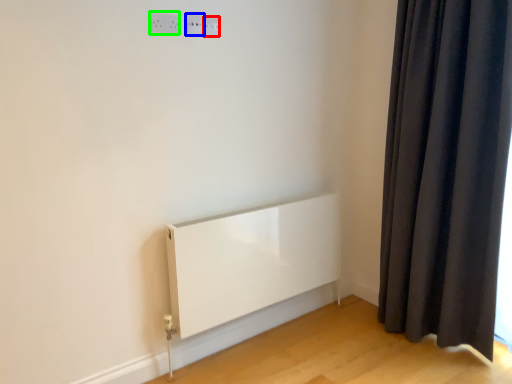
Question: Based on their relative distances, which object is nearer to electric outlet (highlighted by a red box)? Choose from electric outlet (highlighted by a blue box) and electric outlet (highlighted by a green box).

Choices:
 (A) electric outlet
 (B) electric outlet

Answer: (A)